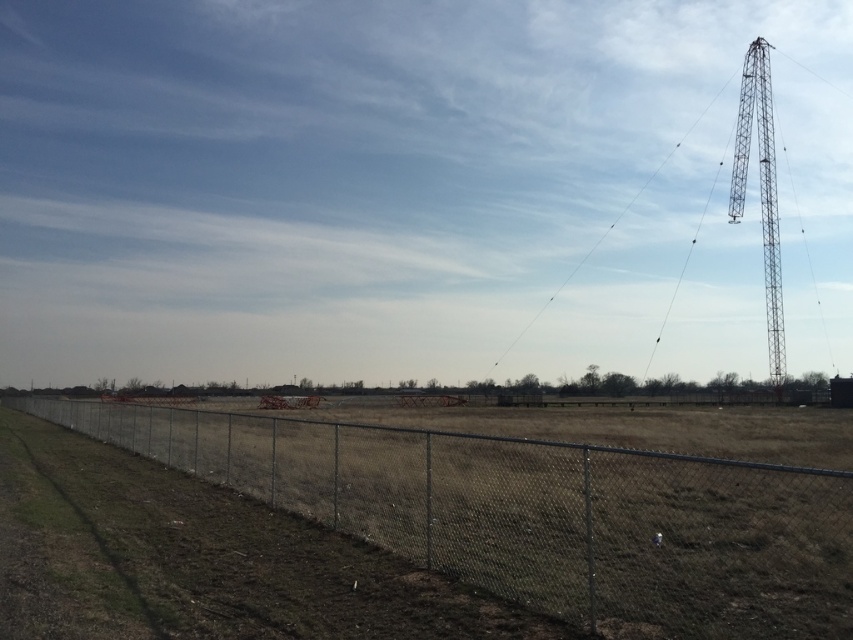
You are standing in the open field bordered by a chain link fence on the left. You see two points marked in the scene, point A at coordinates point (669, 452) and point B at coordinates point (770, 216). Which point is closer to you?

Point point (669, 452) is closer to the viewer than point point (770, 216).

You are a bird flying over the open field. You want to land on the tallest structure you can see. Which one should you choose between the metallic lattice tower at right and the metallic wire at upper right?

The metallic wire at upper right is taller than the metallic lattice tower at right, so you should choose the metallic wire at upper right to land on the tallest structure.